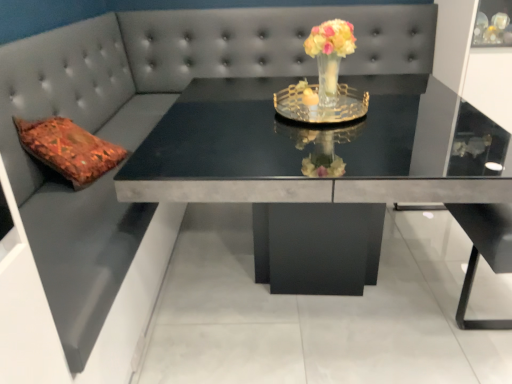
Find the location of a particular element. translucent glass vase at center is located at coordinates (330, 55).

What do you see at coordinates (330, 55) in the screenshot? I see `translucent glass vase at center` at bounding box center [330, 55].

This screenshot has height=384, width=512. Describe the element at coordinates (297, 174) in the screenshot. I see `matte gray table at center` at that location.

What is the approximate width of matte gray table at center?

1.35 meters.

Locate an element on the screen. This screenshot has height=384, width=512. matte gray table at center is located at coordinates (297, 174).

Locate an element on the screen. This screenshot has height=384, width=512. translucent glass vase at center is located at coordinates (330, 55).

Is matte gray table at center to the left or to the right of translucent glass vase at center in the image?

From the image, it's evident that matte gray table at center is to the left of translucent glass vase at center.

Which object is more forward, matte gray table at center or translucent glass vase at center?

matte gray table at center is in front.

Which is less distant, (218, 179) or (342, 23)?

The point (218, 179) is more forward.

From the image's perspective, is matte gray table at center under translucent glass vase at center?

Yes, from the image's perspective, matte gray table at center is beneath translucent glass vase at center.

From the picture: From a real-world perspective, is matte gray table at center physically above translucent glass vase at center?

No, from a real-world perspective, matte gray table at center is not above translucent glass vase at center.

Between matte gray table at center and translucent glass vase at center, which one has larger width?

matte gray table at center is wider.

Which of these two, matte gray table at center or translucent glass vase at center, stands taller?

Standing taller between the two is matte gray table at center.

Based on their sizes in the image, would you say matte gray table at center is bigger or smaller than translucent glass vase at center?

In the image, matte gray table at center appears to be larger than translucent glass vase at center.

Would you say matte gray table at center is inside or outside translucent glass vase at center?

matte gray table at center is located beyond the bounds of translucent glass vase at center.

Is matte gray table at center with translucent glass vase at center?

No, matte gray table at center is not making contact with translucent glass vase at center.

Could you tell me if matte gray table at center is facing translucent glass vase at center?

No, matte gray table at center does not turn towards translucent glass vase at center.

How different are the orientations of matte gray table at center and translucent glass vase at center in degrees?

7.48 degrees.

Where is `floral arrangement on the right of the matte gray table at center`? The height and width of the screenshot is (384, 512). floral arrangement on the right of the matte gray table at center is located at coordinates (330, 55).

Is translucent glass vase at center at the right side of matte gray table at center?

Yes, translucent glass vase at center is to the right of matte gray table at center.

Is translucent glass vase at center positioned behind matte gray table at center?

Yes, it is behind matte gray table at center.

Is point (328, 96) closer to viewer compared to point (283, 198)?

No, (328, 96) is behind (283, 198).

From the image's perspective, between translucent glass vase at center and matte gray table at center, which one is located above?

translucent glass vase at center appears higher in the image.

From a real-world perspective, is translucent glass vase at center on matte gray table at center?

Indeed, from a real-world perspective, translucent glass vase at center stands above matte gray table at center.

Does translucent glass vase at center have a lesser width compared to matte gray table at center?

Yes.

Is translucent glass vase at center shorter than matte gray table at center?

Indeed, translucent glass vase at center has a lesser height compared to matte gray table at center.

Who is bigger, translucent glass vase at center or matte gray table at center?

Bigger between the two is matte gray table at center.

Is translucent glass vase at center not inside matte gray table at center?

Absolutely, translucent glass vase at center is external to matte gray table at center.

Is translucent glass vase at center in contact with matte gray table at center?

No, translucent glass vase at center is not next to matte gray table at center.

Is translucent glass vase at center positioned with its back to matte gray table at center?

No, translucent glass vase at center is not facing the opposite direction of matte gray table at center.

In the scene shown: Can you tell me how much translucent glass vase at center and matte gray table at center differ in facing direction?

translucent glass vase at center and matte gray table at center are facing 7.48 degrees away from each other.

In the image, there is a translucent glass vase at center. Where is `table below it (from the image's perspective)`? This screenshot has width=512, height=384. table below it (from the image's perspective) is located at coordinates (297, 174).

Identify the location of table in front of the translucent glass vase at center. (297, 174).

Locate an element on the screen. The height and width of the screenshot is (384, 512). table below the translucent glass vase at center (from a real-world perspective) is located at coordinates click(297, 174).